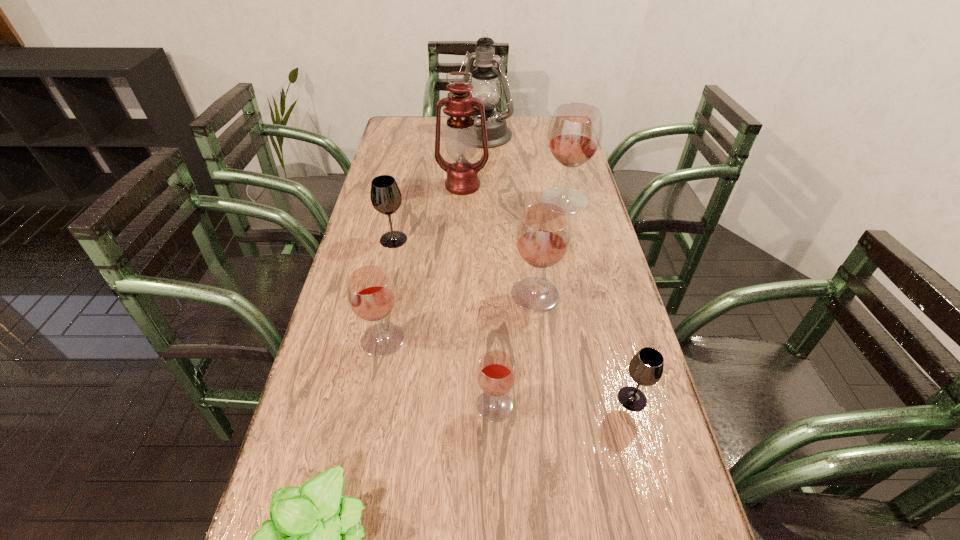
This screenshot has height=540, width=960. I want to click on blank space that satisfies the following two spatial constraints: 1. on the back side of the right gray wineglass; 2. on the left side of the smallest red wineglass, so click(494, 399).

At what (x,y) coordinates should I click in order to perform the action: click on vacant space that satisfies the following two spatial constraints: 1. on the back side of the tallest wineglass; 2. on the left side of the fourth farthest wineglass. Please return your answer as a coordinate pair (x, y). The width and height of the screenshot is (960, 540). Looking at the image, I should click on (409, 201).